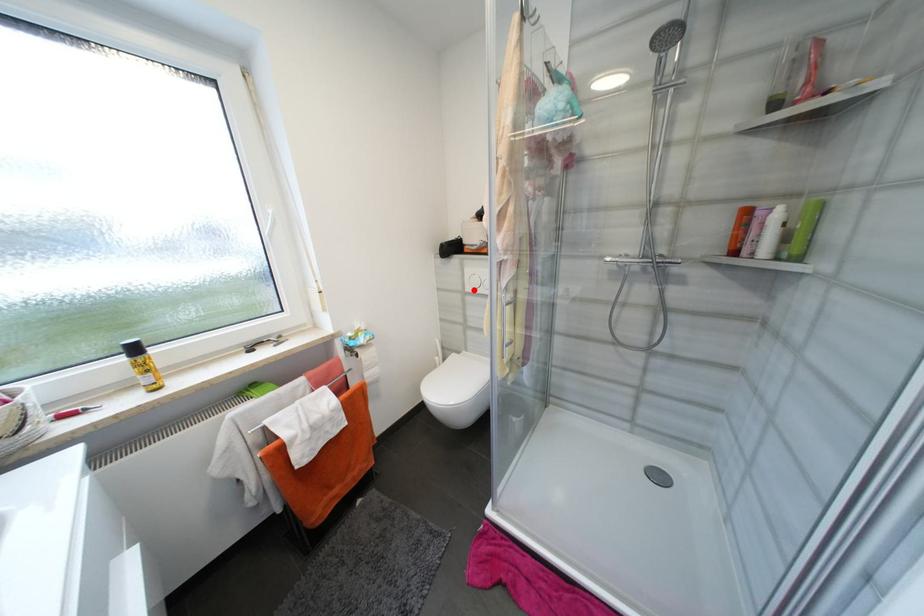
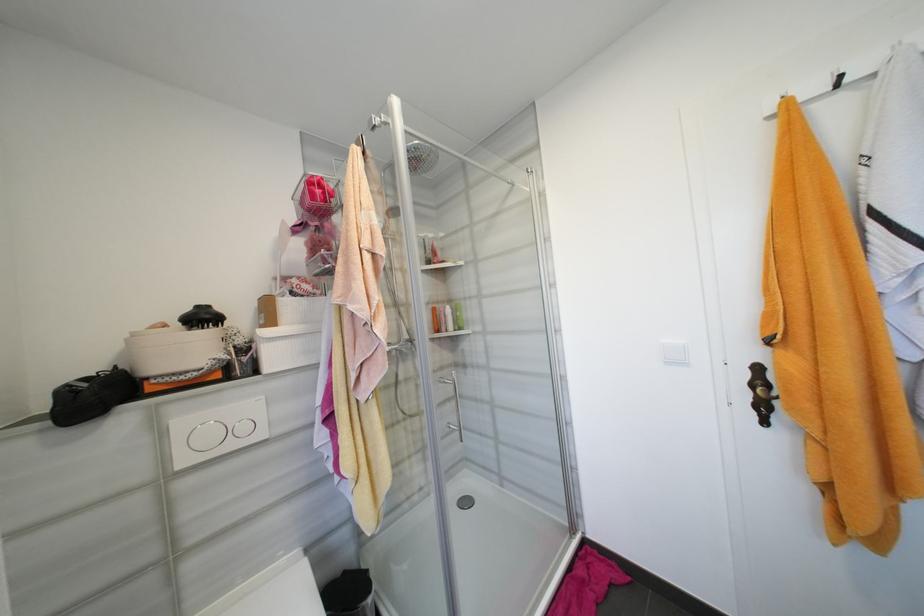
In the second image, find the point that corresponds to the highlighted location in the first image.

(189, 463)